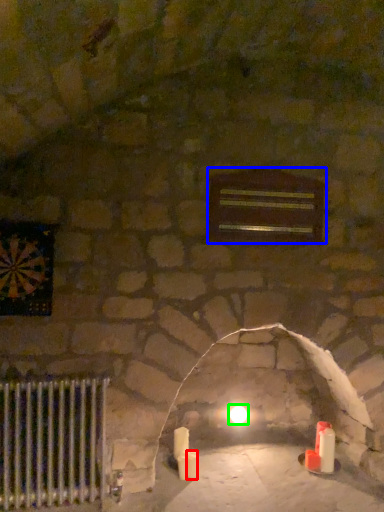
Question: Based on their relative distances, which object is farther from candle (highlighted by a red box)? Choose from window (highlighted by a blue box) and glow (highlighted by a green box).

Choices:
 (A) window
 (B) glow

Answer: (A)